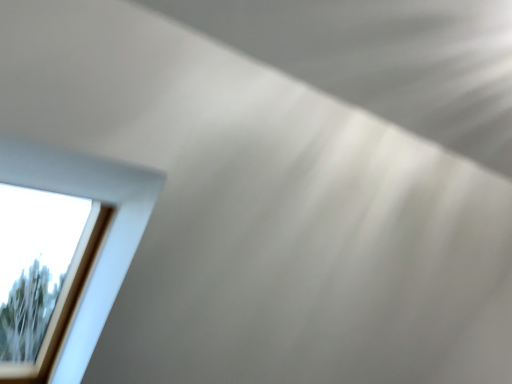
The width and height of the screenshot is (512, 384). What do you see at coordinates (103, 239) in the screenshot?
I see `white wooden window at upper left` at bounding box center [103, 239].

This screenshot has width=512, height=384. I want to click on white wooden window at upper left, so pos(103,239).

This screenshot has height=384, width=512. What are the coordinates of `white wooden window at upper left` in the screenshot? It's located at (103, 239).